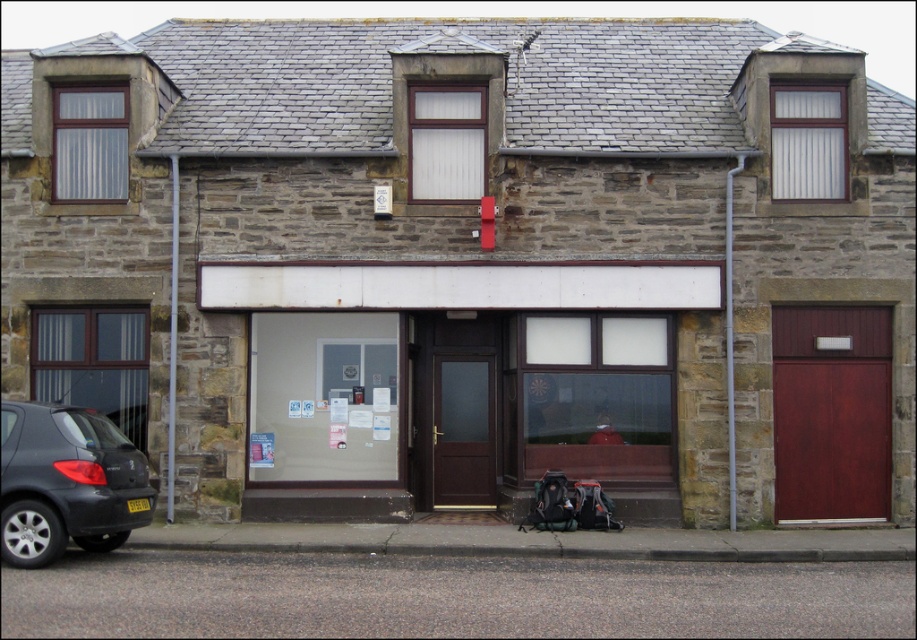
Who is more forward, (841,404) or (103,461)?

Positioned in front is point (103,461).

Between dark red wood door at right and matte black car at lower left, which one appears on the right side from the viewer's perspective?

From the viewer's perspective, dark red wood door at right appears more on the right side.

At what (x,y) coordinates should I click in order to perform the action: click on dark red wood door at right. Please return your answer as a coordinate pair (x, y). The height and width of the screenshot is (640, 917). Looking at the image, I should click on (831, 412).

Find the location of a particular element. The image size is (917, 640). dark red wood door at right is located at coordinates [831, 412].

Who is more forward, (21, 493) or (450, 449)?

Positioned in front is point (21, 493).

Between point (81, 452) and point (449, 493), which one is positioned behind?

Point (449, 493)

Where is `matte black car at lower left`? matte black car at lower left is located at coordinates (65, 483).

Does dark red wood door at right appear on the left side of dark brown wood door at center?

No, dark red wood door at right is not to the left of dark brown wood door at center.

Does point (805, 460) come behind point (449, 480)?

That is False.

Which is in front, point (794, 504) or point (482, 436)?

Point (794, 504) is in front.

Where is `dark red wood door at right`? dark red wood door at right is located at coordinates (831, 412).